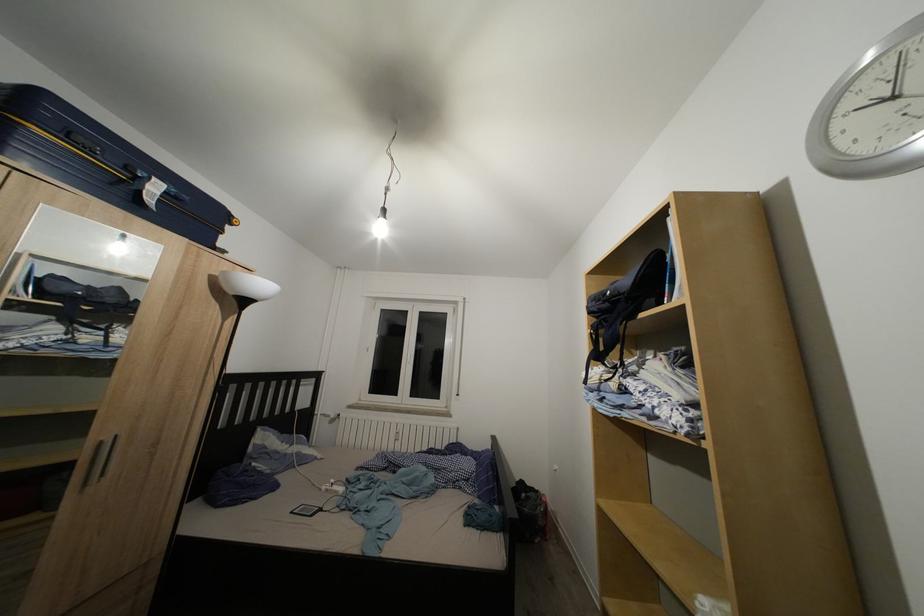
Where is `white window handle`? The height and width of the screenshot is (616, 924). white window handle is located at coordinates (407, 361).